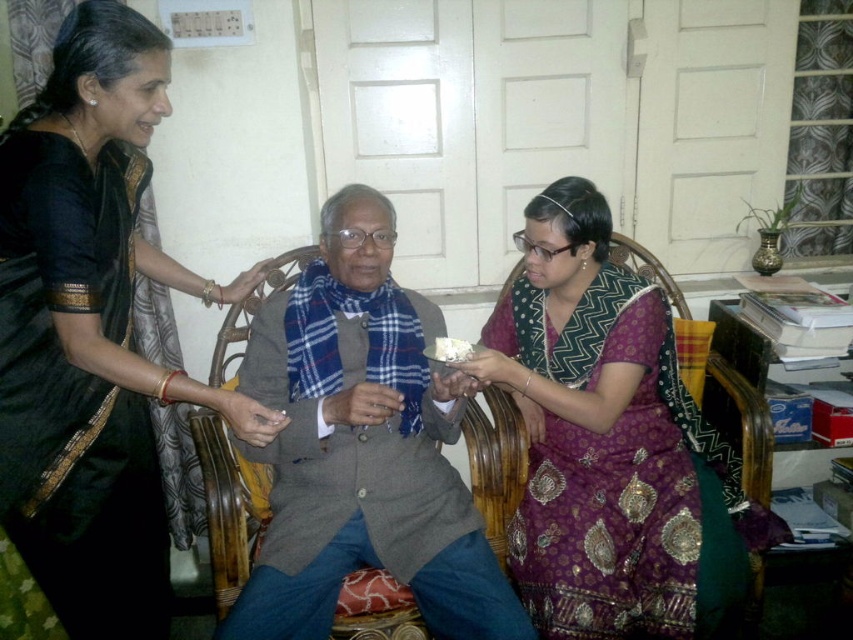
You are a photographer setting up for a family photo. You need to position a light to the right of both the black silk saree at upper left and the purple brocade saree at center. Where should you place the light?

The light should be placed to the right of the purple brocade saree at center since the black silk saree at upper left is to the left of it, ensuring the light is positioned correctly to the right of both.

You are standing in the living room and want to place a tall plant next to the black silk saree at upper left. Can the wicker chair at center be moved to make space?

The black silk saree at upper left is taller than the wicker chair at center, so moving the wicker chair at center might be necessary to accommodate the tall plant, as the saree is already occupying the upper left area.